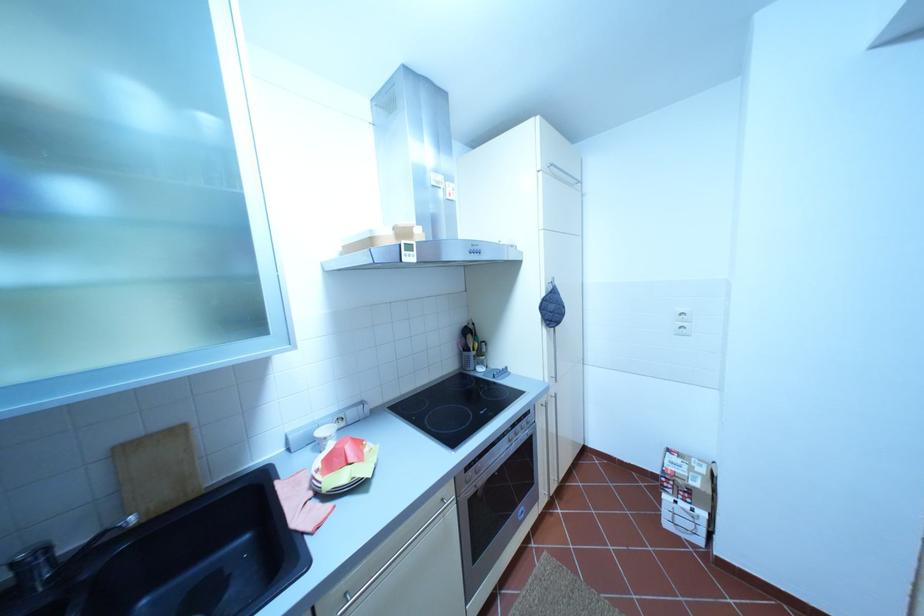
Locate an element on the screen. This screenshot has width=924, height=616. the lower cabinet handle is located at coordinates (410, 548).